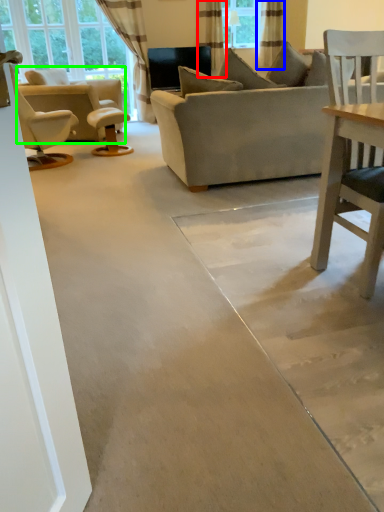
Question: Estimate the real-world distances between objects in this image. Which object is closer to curtain (highlighted by a red box), curtain (highlighted by a blue box) or chair (highlighted by a green box)?

Choices:
 (A) curtain
 (B) chair

Answer: (A)